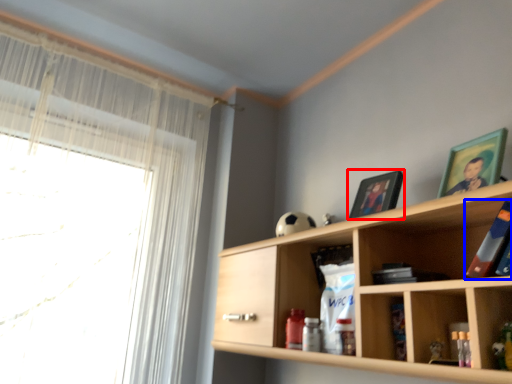
Question: Which object appears closest to the camera in this image, picture frame (highlighted by a red box) or book (highlighted by a blue box)?

Choices:
 (A) picture frame
 (B) book

Answer: (B)